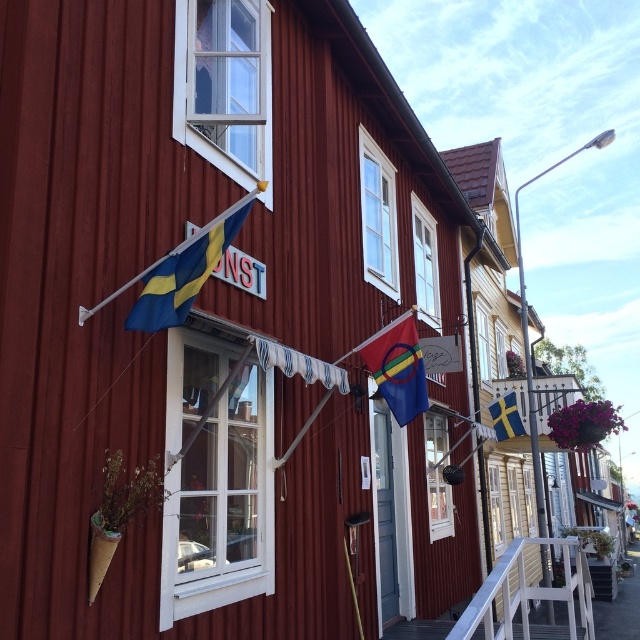
Question: Which point appears farthest from the camera in this image?

Choices:
 (A) (145, 296)
 (B) (513, 428)
 (C) (426, 394)

Answer: (B)

Question: Where is blue/yellow fabric flag at upper left located in relation to reddish-brown fabric flag at center in the image?

Choices:
 (A) above
 (B) below

Answer: (A)

Question: Which object is the closest to the blue/yellow fabric flag at upper left?

Choices:
 (A) reddish-brown fabric flag at center
 (B) blue and yellow fabric flag at upper right

Answer: (A)

Question: Can you confirm if blue/yellow fabric flag at upper left is positioned to the right of blue and yellow fabric flag at upper right?

Choices:
 (A) no
 (B) yes

Answer: (A)

Question: Which point is farther to the camera?

Choices:
 (A) (412, 321)
 (B) (518, 419)
 (C) (179, 312)

Answer: (B)

Question: Can you confirm if blue/yellow fabric flag at upper left is positioned to the left of blue and yellow fabric flag at upper right?

Choices:
 (A) no
 (B) yes

Answer: (B)